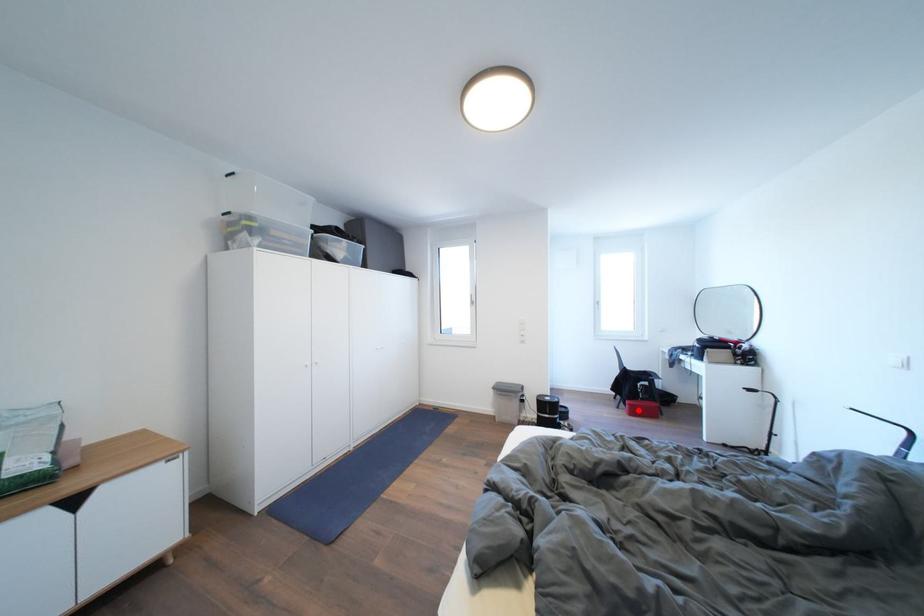
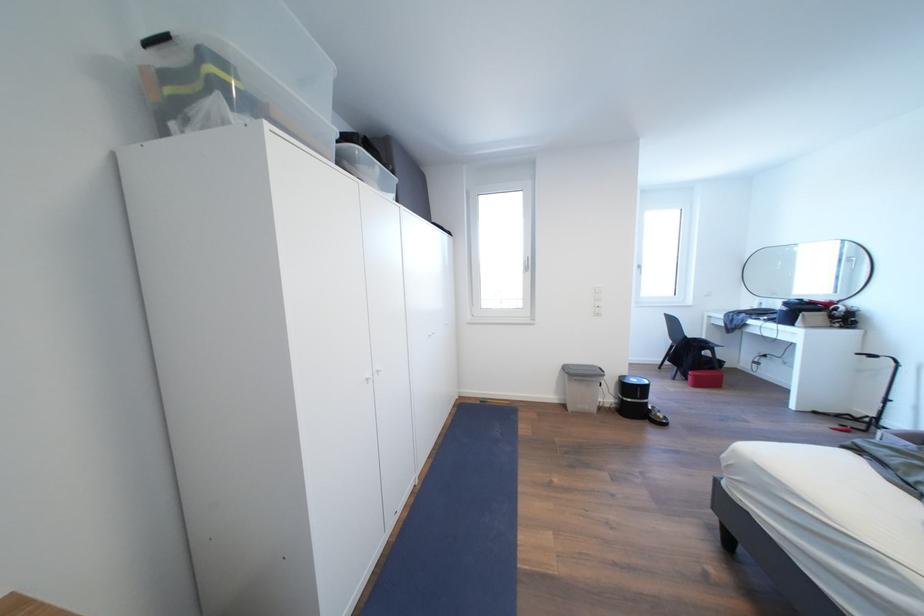
In the second image, find the point that corresponds to the highlighted location in the first image.

(703, 381)